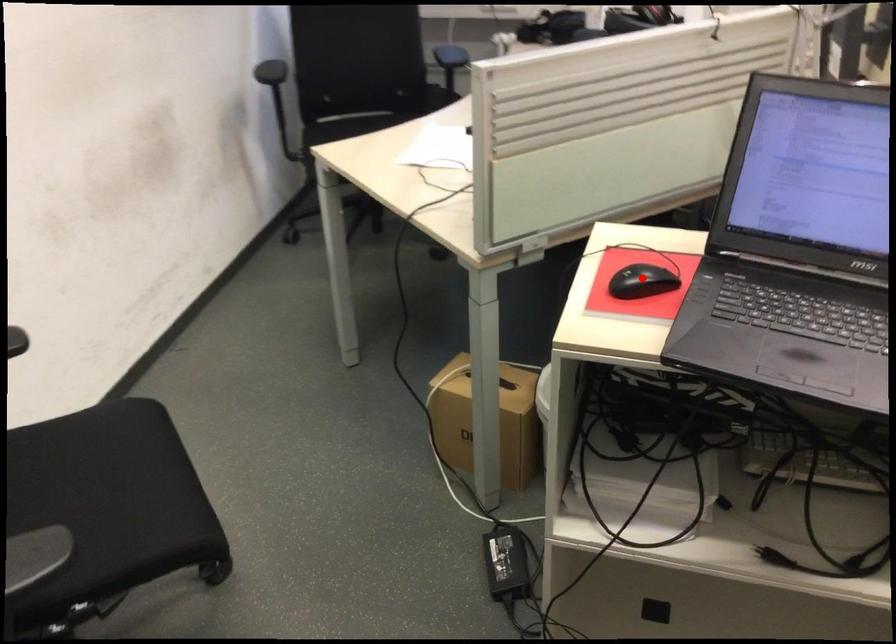
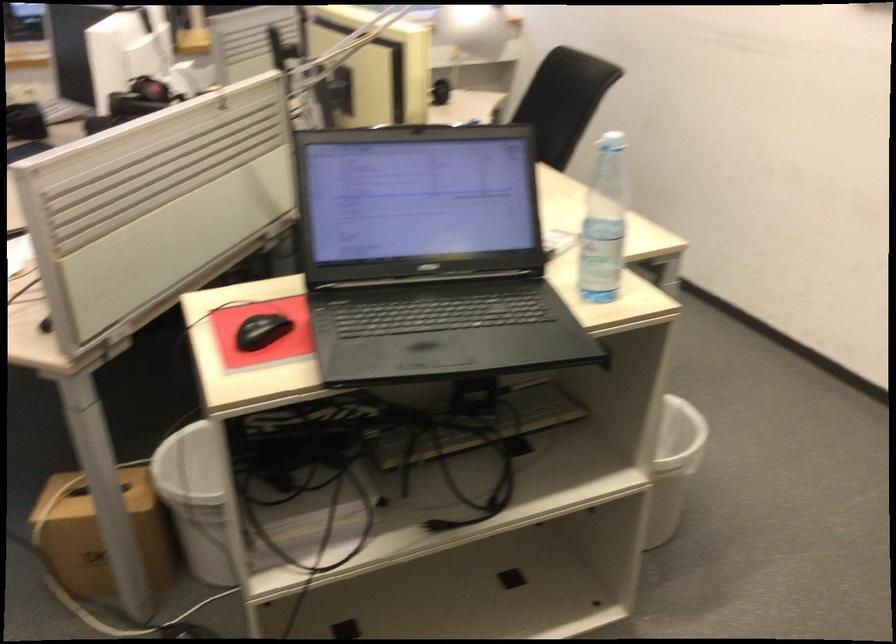
Where in the second image is the point corresponding to the highlighted location from the first image?

(261, 330)